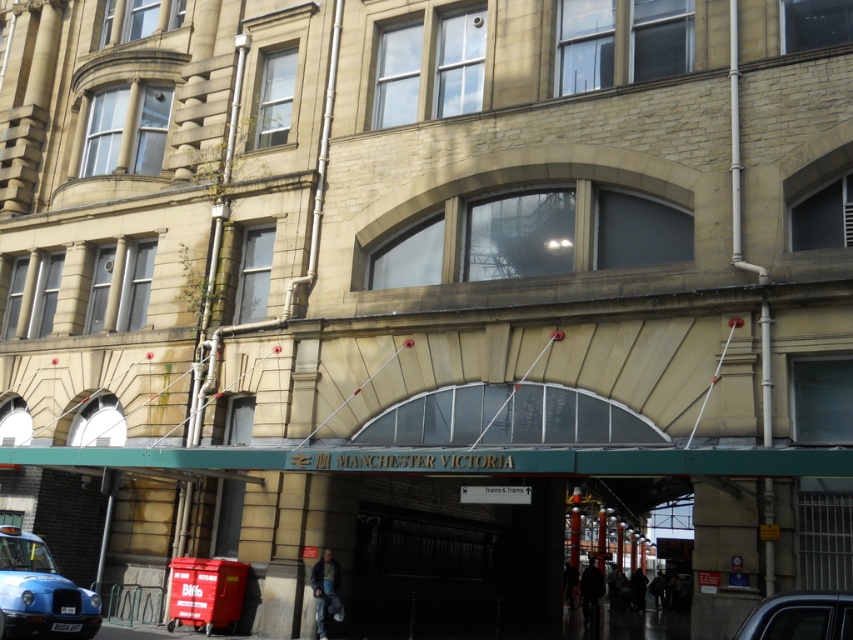
Question: Does matte blue taxi at lower left appear under metallic blue car at lower right?

Choices:
 (A) yes
 (B) no

Answer: (A)

Question: Can you confirm if matte blue taxi at lower left is bigger than metallic blue car at lower right?

Choices:
 (A) no
 (B) yes

Answer: (B)

Question: Which point is farther to the camera?

Choices:
 (A) (9, 532)
 (B) (816, 602)

Answer: (A)

Question: Which point appears farthest from the camera in this image?

Choices:
 (A) tap(32, 547)
 (B) tap(851, 593)

Answer: (A)

Question: Can you confirm if matte blue taxi at lower left is positioned above metallic blue car at lower right?

Choices:
 (A) yes
 (B) no

Answer: (B)